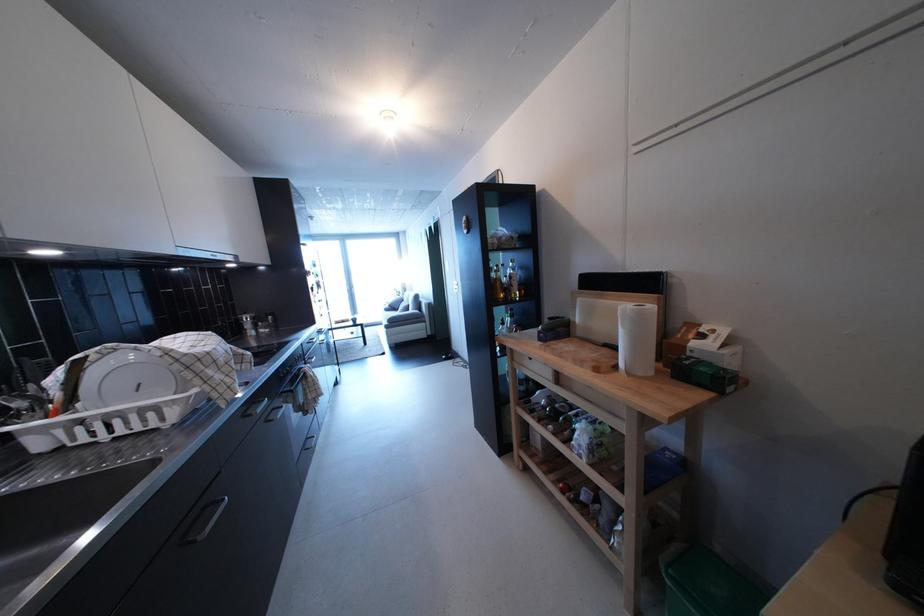
At what (x,y) coordinates should I click in order to perform the action: click on sofa sitting surface. Please return your answer as a coordinate pair (x, y). Image resolution: width=924 pixels, height=616 pixels. Looking at the image, I should click on (395, 302).